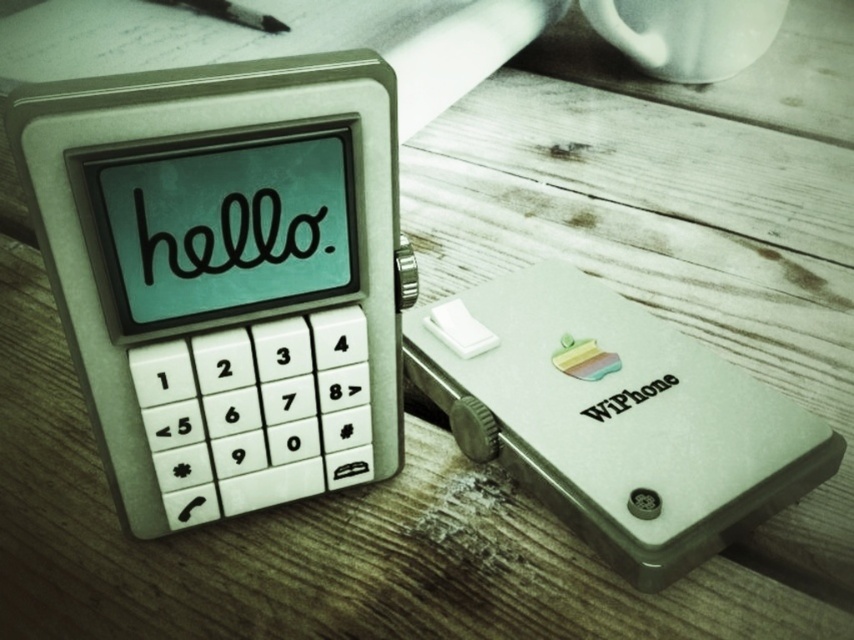
You are standing in front of a wooden desk and see the matte white phone at center. If you want to place a sticker exactly at its 2D location, what coordinates should you aim for?

You should aim for the coordinates point [224,275] where the matte white phone at center is located.

From the picture: You are a delivery robot with a package that needs to be placed between the matte white phone at center and the white ceramic mug at upper center. The package is 1.2 meters long. Can you fit the package between them?

The distance between the matte white phone at center and the white ceramic mug at upper center is 1.10 meters. Since the package is 1.2 meters long, it is longer than the available space, so the package cannot be placed between them.

You are organizing a desk and need to place the matte white phone at center and the brushed metal pen at upper left. According to the image, which object is positioned to the right of the other?

The matte white phone at center is to the right of the brushed metal pen at upper left.